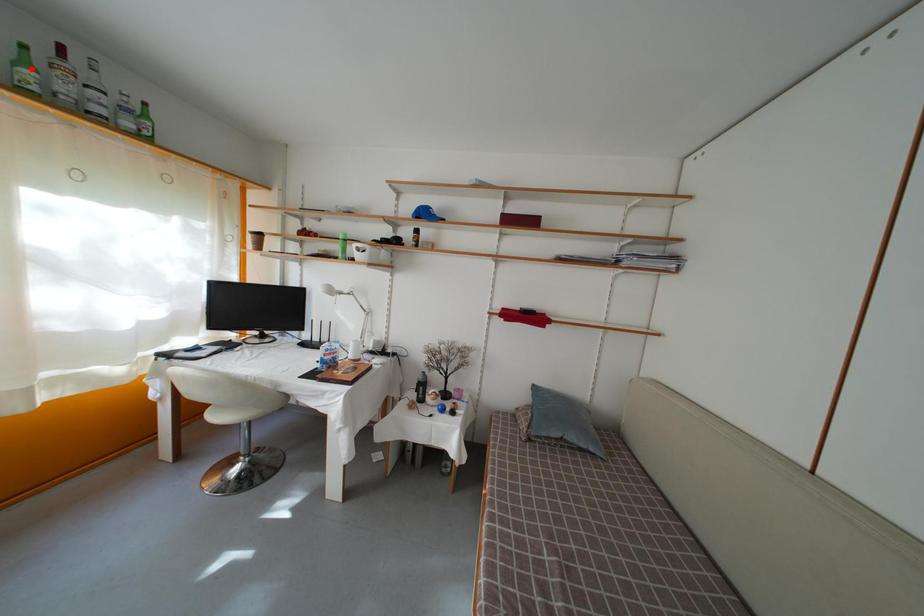
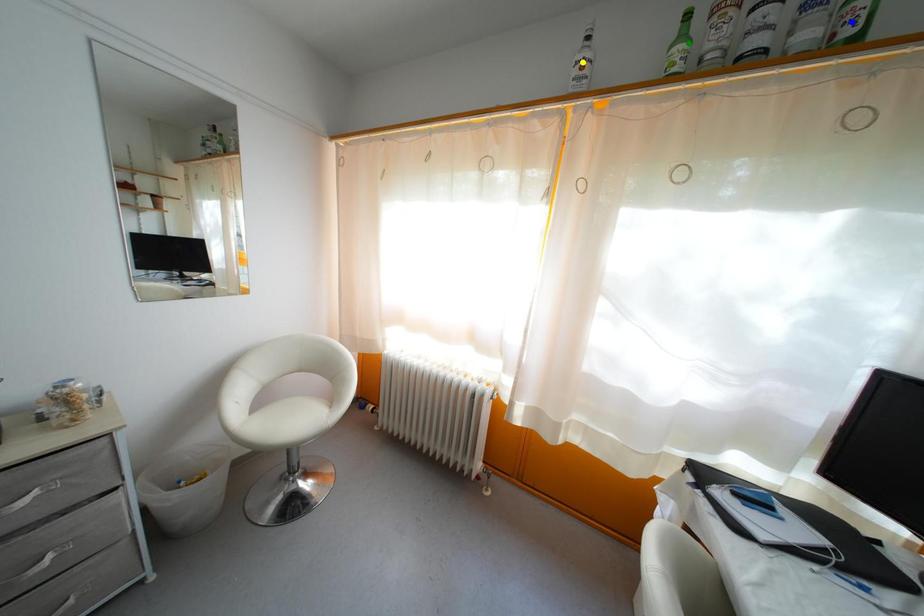
Question: I am providing you with two images of the same scene from different viewpoints. A red point is marked on the first image. You are given multiple points on the second image. In image 2, which mark is for the same physical point as the one in image 1?

Choices:
 (A) blue point
 (B) yellow point
 (C) green point

Answer: (C)